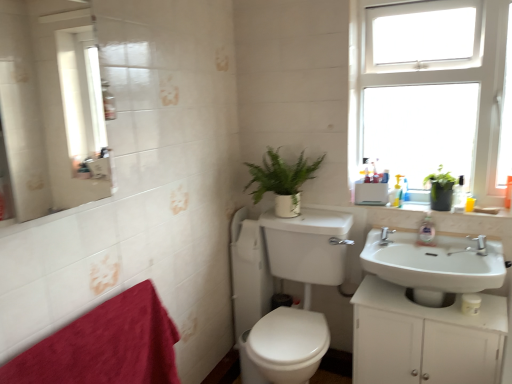
Identify the location of vacant area that is in front of white matte toilet paper at lower center. This screenshot has height=384, width=512. (482, 319).